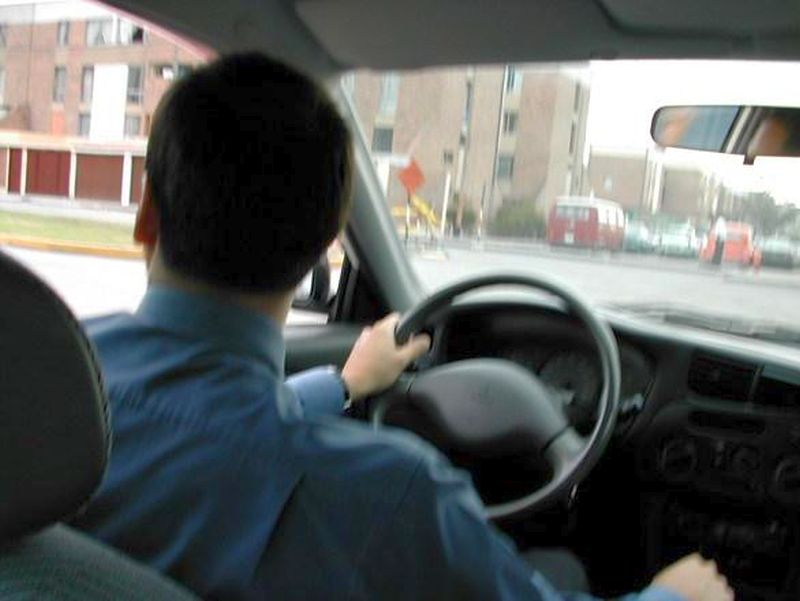
At what (x,y) coordinates should I click in order to perform the action: click on chair. Please return your answer as a coordinate pair (x, y). The width and height of the screenshot is (800, 601). Looking at the image, I should click on (44, 436), (61, 575).